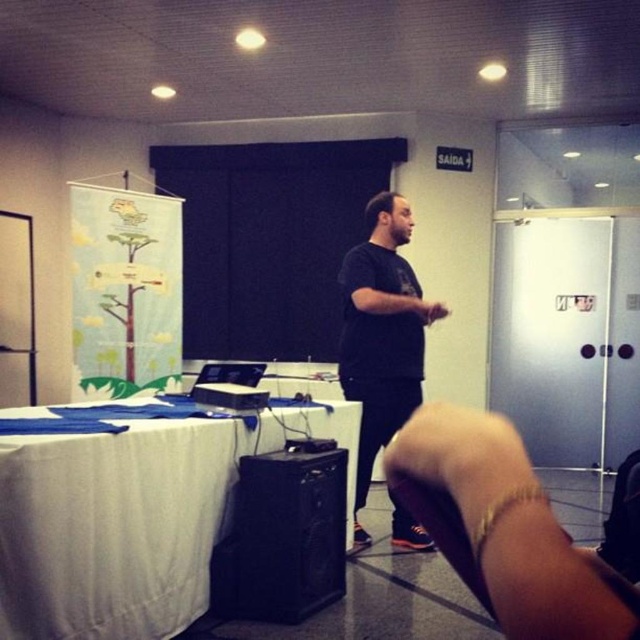
How distant is white fabric table at lower left from black matte shirt at center?

white fabric table at lower left is 83.48 centimeters away from black matte shirt at center.

What do you see at coordinates (131, 518) in the screenshot? I see `white fabric table at lower left` at bounding box center [131, 518].

Is point (28, 461) less distant than point (416, 401)?

Yes, it is in front of point (416, 401).

The image size is (640, 640). In order to click on white fabric table at lower left in this screenshot , I will do `click(131, 518)`.

Which is more to the right, black matte shirt at center or black plastic projector at center?

black matte shirt at center is more to the right.

Is point (408, 304) less distant than point (195, 388)?

No, (408, 304) is behind (195, 388).

I want to click on black matte shirt at center, so click(x=381, y=330).

Between point (145, 552) and point (266, 403), which one is positioned in front?

Point (145, 552) is in front.

Identify the location of white fabric table at lower left. The image size is (640, 640). (131, 518).